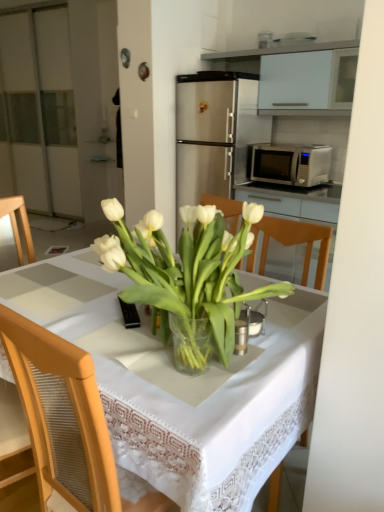
Question: From the image's perspective, is satin silver microwave at center right above black plastic remote control at center?

Choices:
 (A) yes
 (B) no

Answer: (A)

Question: Considering the relative sizes of satin silver microwave at center right and black plastic remote control at center in the image provided, is satin silver microwave at center right taller than black plastic remote control at center?

Choices:
 (A) no
 (B) yes

Answer: (B)

Question: Is satin silver microwave at center right touching black plastic remote control at center?

Choices:
 (A) no
 (B) yes

Answer: (A)

Question: Does satin silver microwave at center right contain black plastic remote control at center?

Choices:
 (A) no
 (B) yes

Answer: (A)

Question: Does satin silver microwave at center right have a lesser height compared to black plastic remote control at center?

Choices:
 (A) no
 (B) yes

Answer: (A)

Question: Is satin silver microwave at center right located outside black plastic remote control at center?

Choices:
 (A) yes
 (B) no

Answer: (A)

Question: Are white glossy cabinet at upper center and satin silver microwave at center right far apart?

Choices:
 (A) no
 (B) yes

Answer: (A)

Question: Is white glossy cabinet at upper center oriented towards satin silver microwave at center right?

Choices:
 (A) no
 (B) yes

Answer: (A)

Question: From a real-world perspective, does white glossy cabinet at upper center stand above satin silver microwave at center right?

Choices:
 (A) yes
 (B) no

Answer: (A)

Question: Can you confirm if white glossy cabinet at upper center is smaller than satin silver microwave at center right?

Choices:
 (A) no
 (B) yes

Answer: (A)

Question: Is white glossy cabinet at upper center positioned behind satin silver microwave at center right?

Choices:
 (A) yes
 (B) no

Answer: (B)

Question: Does white glossy cabinet at upper center appear on the left side of satin silver microwave at center right?

Choices:
 (A) no
 (B) yes

Answer: (B)

Question: From the image's perspective, does white glossy cabinet at upper center appear lower than transparent glass vase at center?

Choices:
 (A) no
 (B) yes

Answer: (A)